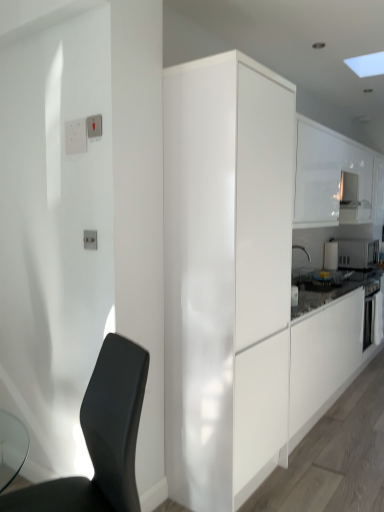
Question: From the image's perspective, does white glossy microwave at upper right, the second appliance when ordered from left to right, appear lower than white glossy electrical outlet at upper left?

Choices:
 (A) yes
 (B) no

Answer: (A)

Question: From the image's perspective, is white glossy microwave at upper right, the second appliance when ordered from left to right, on top of white glossy electrical outlet at upper left?

Choices:
 (A) no
 (B) yes

Answer: (A)

Question: Is white glossy microwave at upper right, arranged as the 1th appliance when viewed from the right, aimed at white glossy electrical outlet at upper left?

Choices:
 (A) yes
 (B) no

Answer: (B)

Question: Is white glossy microwave at upper right, arranged as the 1th appliance when viewed from the right, not near white glossy electrical outlet at upper left?

Choices:
 (A) no
 (B) yes

Answer: (B)

Question: Is white glossy electrical outlet at upper left surrounded by white glossy microwave at upper right, the second appliance when ordered from left to right?

Choices:
 (A) no
 (B) yes

Answer: (A)

Question: From a real-world perspective, is white glossy microwave at upper right, the second appliance when ordered from left to right, over white glossy electrical outlet at upper left?

Choices:
 (A) no
 (B) yes

Answer: (A)

Question: From the image's perspective, is glossy white cabinet at center, which ranks as the 1th cabinetry in front-to-back order, above white glossy microwave at upper right, the second appliance when ordered from left to right?

Choices:
 (A) no
 (B) yes

Answer: (A)

Question: Is glossy white cabinet at center, placed as the first cabinetry when sorted from left to right, turned away from white glossy microwave at upper right, arranged as the 1th appliance when viewed from the right?

Choices:
 (A) no
 (B) yes

Answer: (A)

Question: Considering the relative sizes of glossy white cabinet at center, which ranks as the 1th cabinetry in front-to-back order, and white glossy microwave at upper right, arranged as the 1th appliance when viewed from the right, in the image provided, is glossy white cabinet at center, which ranks as the 1th cabinetry in front-to-back order, taller than white glossy microwave at upper right, arranged as the 1th appliance when viewed from the right,?

Choices:
 (A) no
 (B) yes

Answer: (B)

Question: Considering the relative positions of glossy white cabinet at center, which ranks as the 2th cabinetry in back-to-front order, and white glossy microwave at upper right, the second appliance when ordered from left to right, in the image provided, is glossy white cabinet at center, which ranks as the 2th cabinetry in back-to-front order, in front of white glossy microwave at upper right, the second appliance when ordered from left to right,?

Choices:
 (A) no
 (B) yes

Answer: (B)

Question: Does glossy white cabinet at center, which ranks as the 1th cabinetry in front-to-back order, have a smaller size compared to white glossy microwave at upper right, the second appliance when ordered from left to right?

Choices:
 (A) yes
 (B) no

Answer: (B)

Question: Considering the relative sizes of glossy white cabinet at center, which ranks as the 2th cabinetry in back-to-front order, and white glossy microwave at upper right, arranged as the 1th appliance when viewed from the right, in the image provided, is glossy white cabinet at center, which ranks as the 2th cabinetry in back-to-front order, shorter than white glossy microwave at upper right, arranged as the 1th appliance when viewed from the right,?

Choices:
 (A) no
 (B) yes

Answer: (A)

Question: Can you confirm if white glossy cabinet at upper right, marked as the 2th cabinetry in a left-to-right arrangement, is thinner than glossy white cabinet at center, placed as the first cabinetry when sorted from left to right?

Choices:
 (A) no
 (B) yes

Answer: (B)